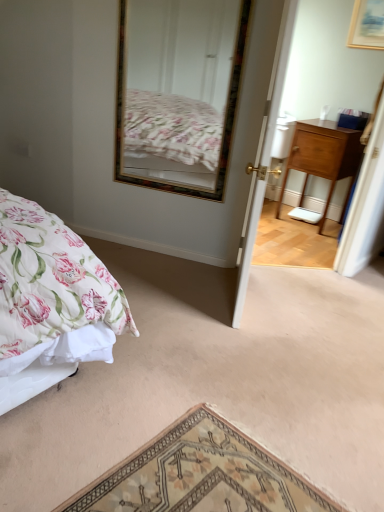
Find the location of a particular element. vacant area that lies to the right of white wooden door at center is located at coordinates (304, 307).